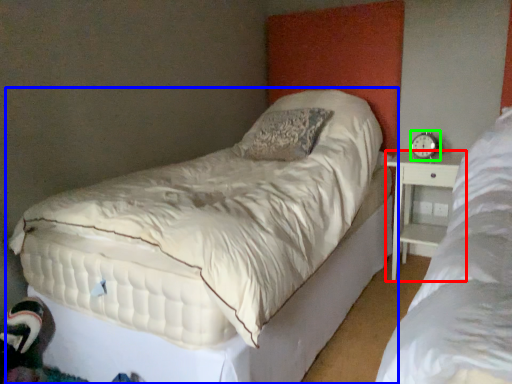
Question: Considering the real-world distances, which object is closest to nightstand (highlighted by a red box)? bed (highlighted by a blue box) or alarm clock (highlighted by a green box).

Choices:
 (A) bed
 (B) alarm clock

Answer: (B)